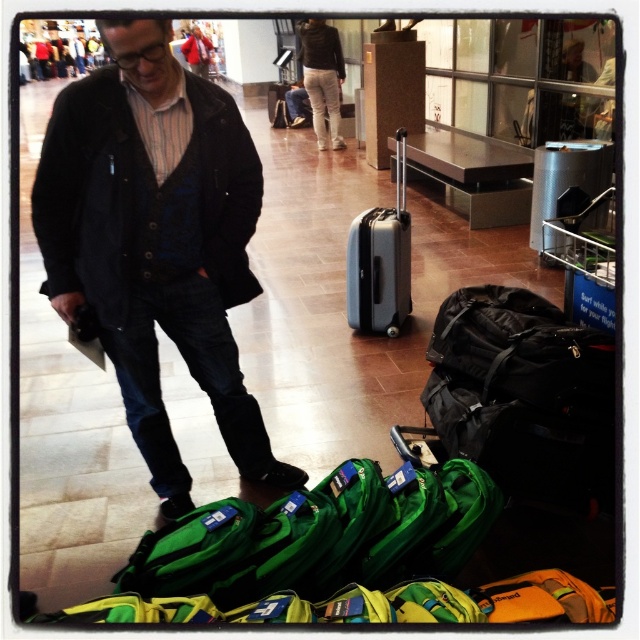
Consider the image. You are standing at the point marked as point (157, 243) in the airport terminal. What object is located at that exact point?

The dark blue jeans at lower left are located at point (157, 243).

You are a traveler trying to locate your luggage in the airport terminal. You see the dark blue jeans at lower left and the silver metallic suitcase at center. Which one is closer to the left side of the scene?

The dark blue jeans at lower left is positioned on the left side of the silver metallic suitcase at center, so it is closer to the left side of the scene.

You are a traveler trying to fit your luggage into an overhead compartment. The compartment has a width limit of 40 cm. You have the dark blue jeans at lower left and the silver metallic suitcase at center. Which item is more likely to exceed the width limit based on their sizes?

The dark blue jeans at lower left is wider than the silver metallic suitcase at center, so the dark blue jeans at lower left is more likely to exceed the 40 cm width limit.